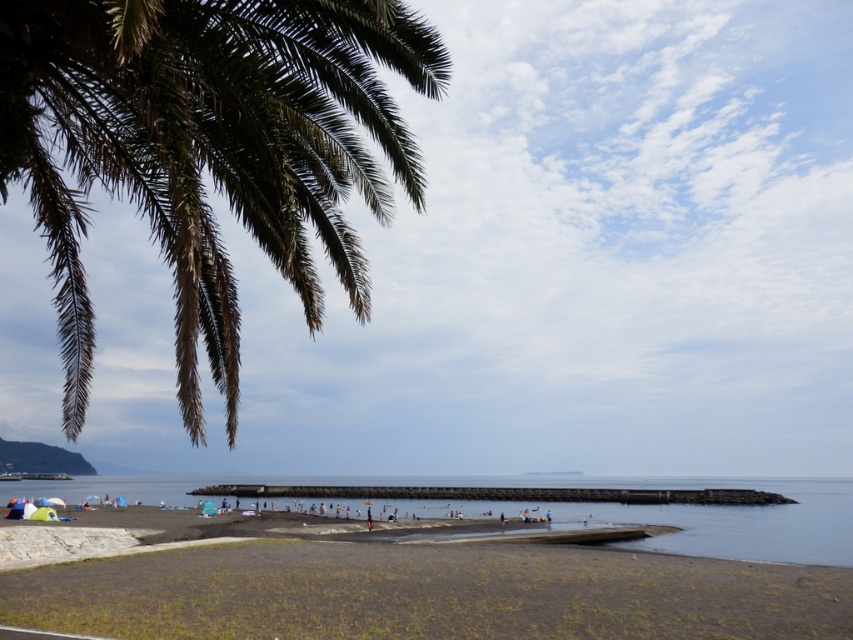
You are standing at the waterline on the beach and want to reach the brown dry palm leaves at upper left located at point (207,148). Which direction should you walk to get there?

To reach the brown dry palm leaves at upper left located at point (207,148), you should walk towards the upper left direction from your current position at the waterline.